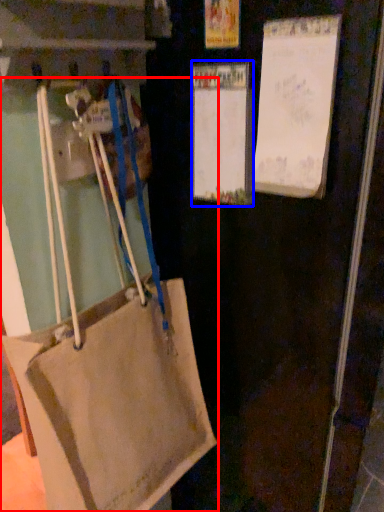
Question: Which of the following is the closest to the observer, handbag (highlighted by a red box) or bulletin board (highlighted by a blue box)?

Choices:
 (A) handbag
 (B) bulletin board

Answer: (A)